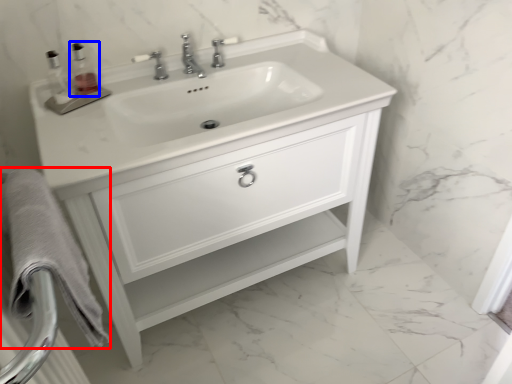
Question: Which of the following is the closest to the observer, bath towel (highlighted by a red box) or soap dispenser (highlighted by a blue box)?

Choices:
 (A) bath towel
 (B) soap dispenser

Answer: (A)